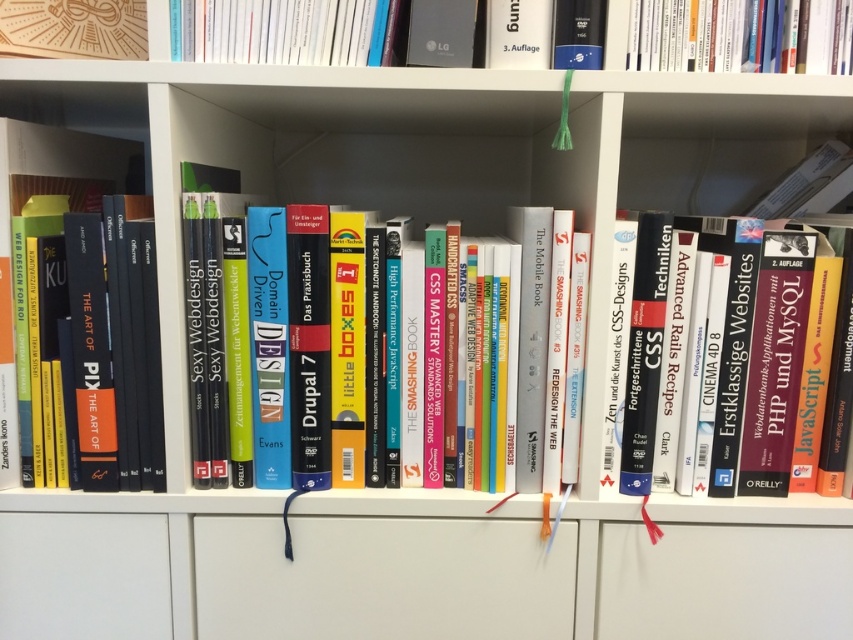
What is the position of the hardcover book marked by point (x=740, y=35) on the bookshelf?

The point (x=740, y=35) marks the hardcover book at upper center on the bookshelf.

You are a librarian trying to organize books on a shelf. You have a new book that is 8 inches wide. You want to place it between the hardcover book at upper center and the hardcover books at center. Is there enough space for it?

The distance between the hardcover book at upper center and the hardcover books at center is 9.01 inches, so yes, the 8 inch wide book can fit in the space between them.